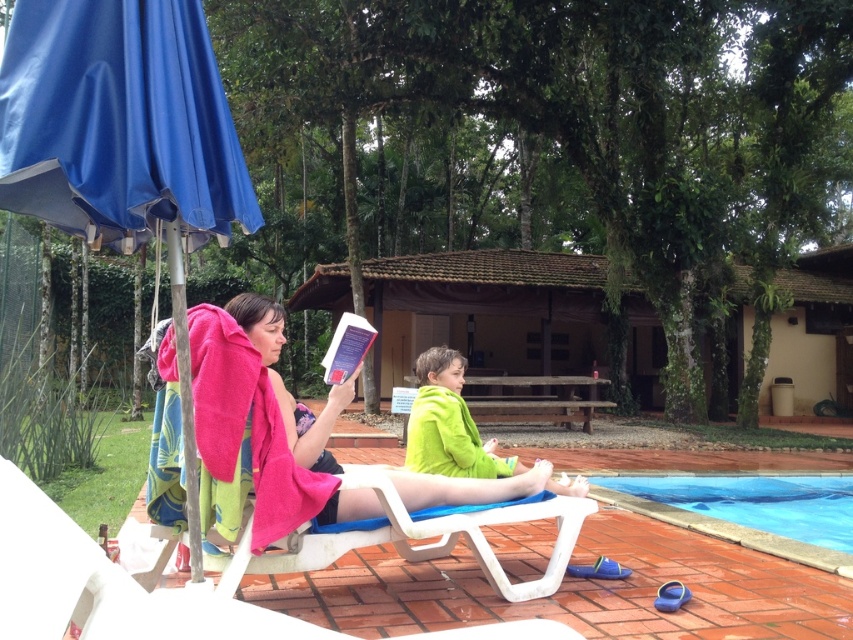
Consider the image. Between blue fabric umbrella at upper left and blue smooth water at lower center, which one appears on the left side from the viewer's perspective?

blue fabric umbrella at upper left is more to the left.

Can you confirm if blue fabric umbrella at upper left is positioned to the left of blue smooth water at lower center?

Yes, blue fabric umbrella at upper left is to the left of blue smooth water at lower center.

You are a GUI agent. You are given a task and a screenshot of the screen. Output one action in this format:
    pyautogui.click(x=<x>, y=<y>)
    Task: Click on the blue fabric umbrella at upper left
    
    Given the screenshot: What is the action you would take?
    pyautogui.click(x=123, y=141)

Which is below, blue fabric umbrella at upper left or pink towel at center?

pink towel at center is below.

Does blue fabric umbrella at upper left have a lesser height compared to pink towel at center?

No, blue fabric umbrella at upper left is not shorter than pink towel at center.

Is point (13, 52) farther from viewer compared to point (495, 488)?

No, (13, 52) is in front of (495, 488).

I want to click on blue fabric umbrella at upper left, so click(x=123, y=141).

Which is below, pink towel at center or blue smooth water at lower center?

blue smooth water at lower center is below.

Measure the distance from pink towel at center to blue smooth water at lower center.

pink towel at center and blue smooth water at lower center are 16.62 feet apart from each other.

Which is behind, point (451, 493) or point (698, 481)?

Positioned behind is point (698, 481).

You are a GUI agent. You are given a task and a screenshot of the screen. Output one action in this format:
    pyautogui.click(x=<x>, y=<y>)
    Task: Click on the pink towel at center
    This screenshot has width=853, height=640.
    Given the screenshot: What is the action you would take?
    pyautogui.click(x=283, y=387)